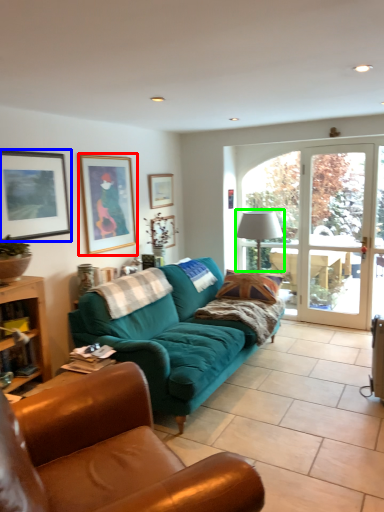
Question: Estimate the real-world distances between objects in this image. Which object is closer to picture frame (highlighted by a red box), picture frame (highlighted by a blue box) or lamp (highlighted by a green box)?

Choices:
 (A) picture frame
 (B) lamp

Answer: (A)